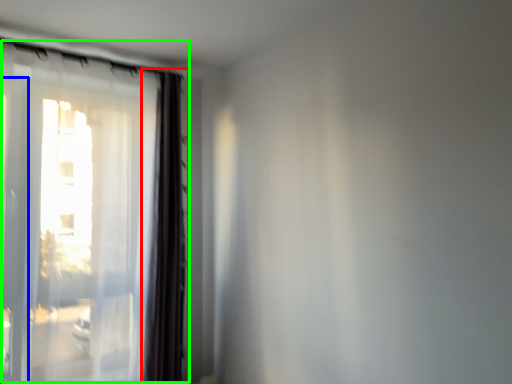
Question: Considering the real-world distances, which object is farthest from curtain (highlighted by a red box)? screen door (highlighted by a blue box) or window (highlighted by a green box)?

Choices:
 (A) screen door
 (B) window

Answer: (A)